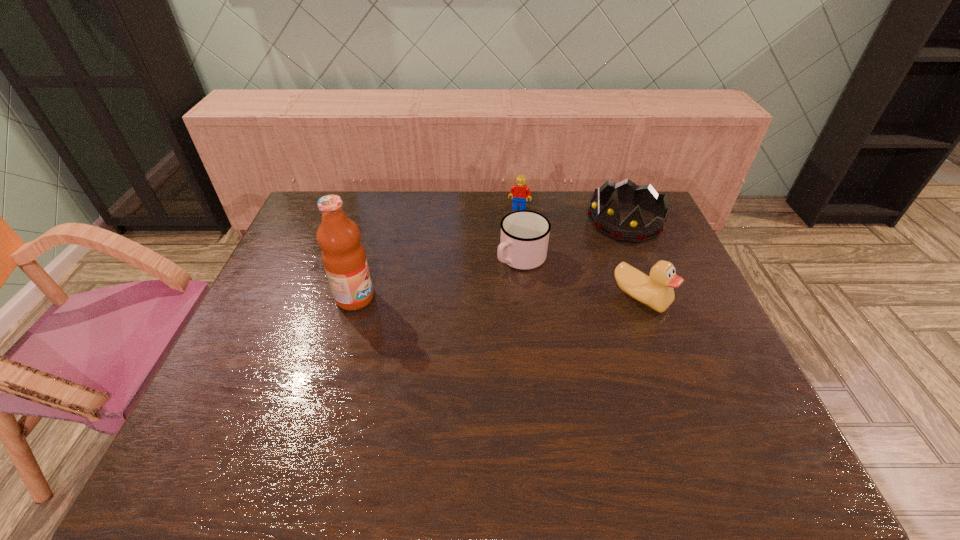
The width and height of the screenshot is (960, 540). Identify the location of vacant point located on the face of the Lego. (510, 233).

Locate an element on the screen. The width and height of the screenshot is (960, 540). vacant space situated on the side of the mug with the handle is located at coordinates (431, 330).

Locate an element on the screen. free space located 0.240m on the side of the mug with the handle is located at coordinates (448, 317).

This screenshot has width=960, height=540. I want to click on blank area located on the side of the mug with the handle, so click(x=456, y=311).

The image size is (960, 540). Find the location of `vacant space located 0.370m at the front of the fourth shortest object with jewels`. vacant space located 0.370m at the front of the fourth shortest object with jewels is located at coordinates (528, 296).

Where is `vacant area located 0.170m at the front of the fourth shortest object with jewels`? This screenshot has height=540, width=960. vacant area located 0.170m at the front of the fourth shortest object with jewels is located at coordinates (571, 263).

Find the location of a particular element. The image size is (960, 540). vacant space located at the front of the fourth shortest object with jewels is located at coordinates (530, 294).

Where is `Lego located at the far edge`? Image resolution: width=960 pixels, height=540 pixels. Lego located at the far edge is located at coordinates (519, 192).

Where is `tiara that is at the far edge`? tiara that is at the far edge is located at coordinates (632, 229).

Locate an element on the screen. Image resolution: width=960 pixels, height=540 pixels. duck located at the right edge is located at coordinates (656, 291).